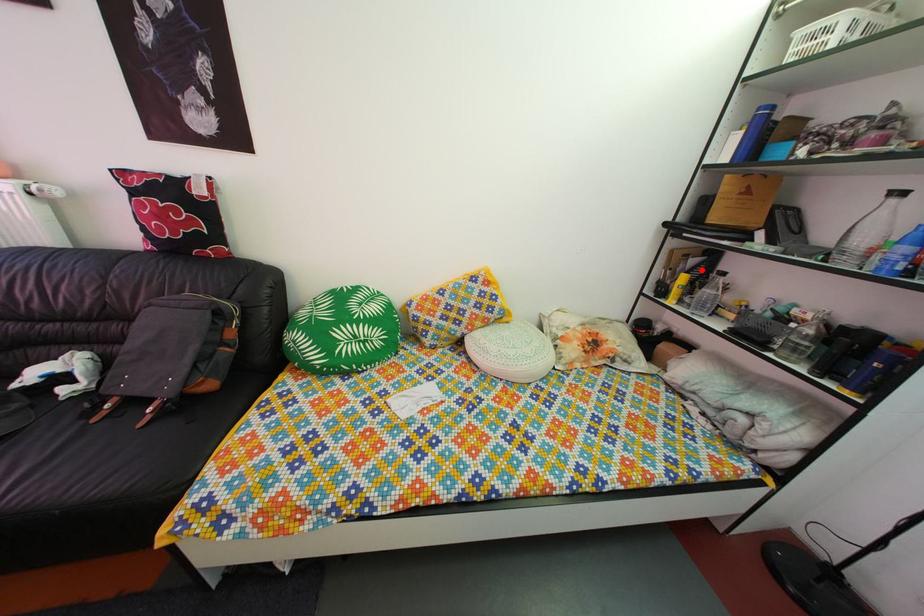
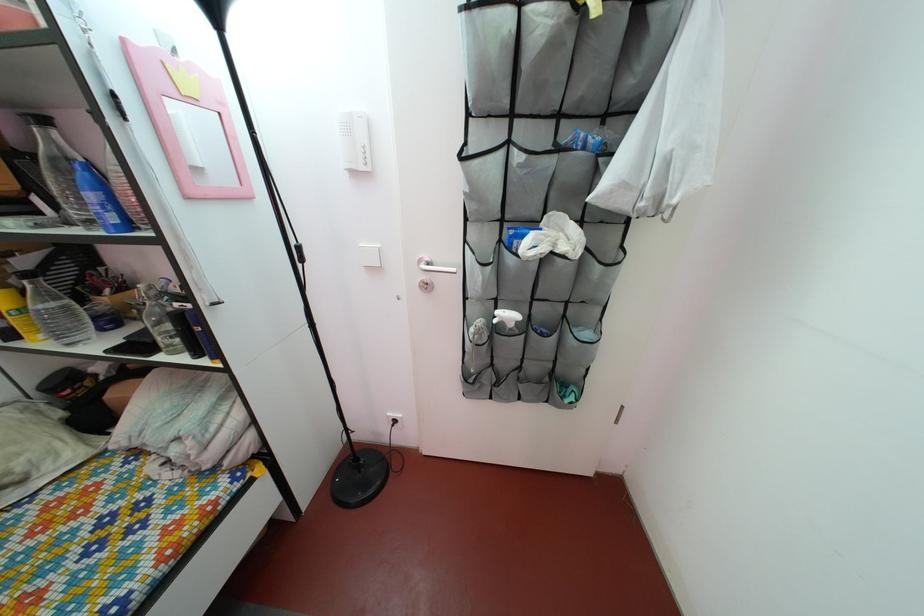
In the second image, find the point that corresponds to the highlighted location in the first image.

(32, 270)